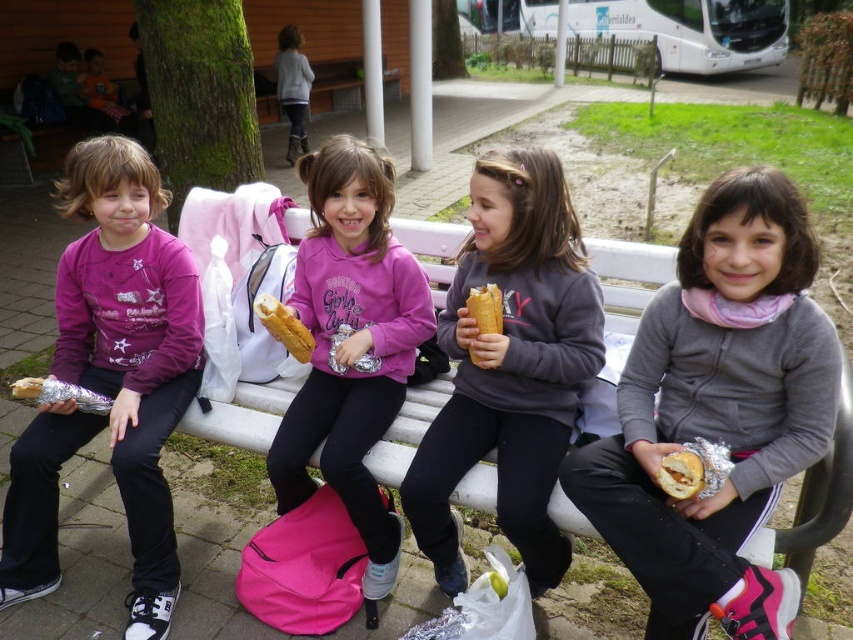
Between gray fleece jacket at center and golden brown bread at lower right, which one has more height?

gray fleece jacket at center

What do you see at coordinates (718, 412) in the screenshot? Image resolution: width=853 pixels, height=640 pixels. I see `gray fleece jacket at center` at bounding box center [718, 412].

Locate an element on the screen. Image resolution: width=853 pixels, height=640 pixels. gray fleece jacket at center is located at coordinates (718, 412).

This screenshot has height=640, width=853. What do you see at coordinates (680, 474) in the screenshot?
I see `golden brown bread at lower right` at bounding box center [680, 474].

Measure the distance between point (x=676, y=460) and camera.

The distance of point (x=676, y=460) from camera is 4.95 feet.

Identify the location of golden brown bread at lower right. (680, 474).

Can you confirm if matte purple sweatshirt at left is bigger than matte gold foil at lower left?

Correct, matte purple sweatshirt at left is larger in size than matte gold foil at lower left.

Which is above, matte purple sweatshirt at left or matte gold foil at lower left?

matte purple sweatshirt at left is higher up.

Is point (183, 381) closer to camera compared to point (21, 385)?

No, (183, 381) is further to viewer.

Where is `matte purple sweatshirt at left`? matte purple sweatshirt at left is located at coordinates (131, 346).